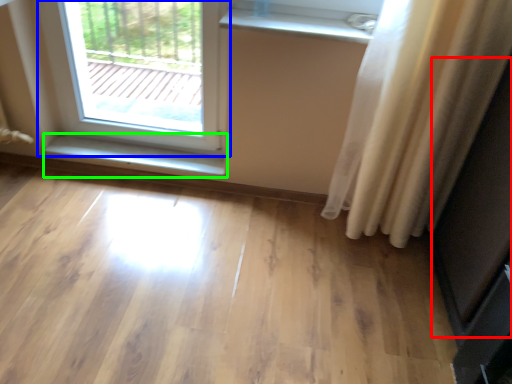
Question: Estimate the real-world distances between objects in this image. Which object is farther from screen door (highlighted by a red box), window (highlighted by a blue box) or window sill (highlighted by a green box)?

Choices:
 (A) window
 (B) window sill

Answer: (A)